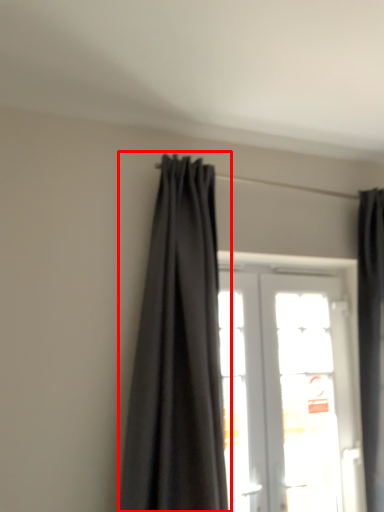
Question: Observing the image, what is the correct spatial positioning of curtain (annotated by the red box) in reference to door?

Choices:
 (A) left
 (B) right

Answer: (A)